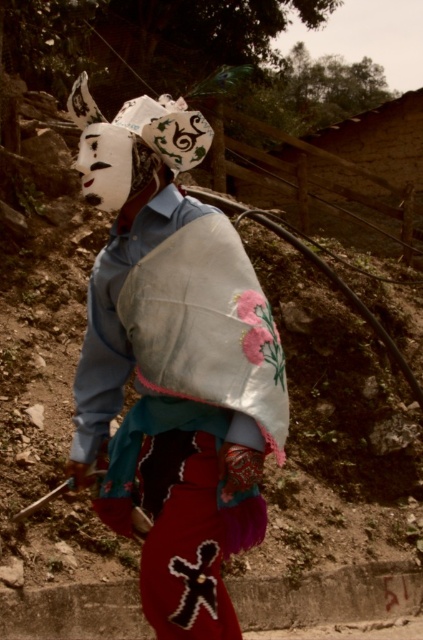
Does point (93, 435) come in front of point (181, 148)?

No, (93, 435) is further to viewer.

Between point (191, 401) and point (125, 122), which one is positioned in front?

Point (191, 401) is more forward.

Who is more forward, (202, 120) or (137, 112)?

Point (202, 120) is more forward.

Find the location of `white matte mask at upper left`. white matte mask at upper left is located at coordinates (173, 364).